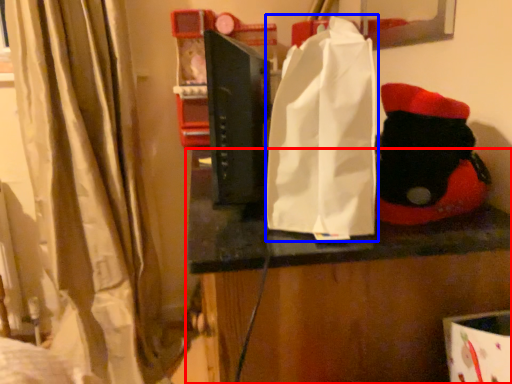
Question: Among these objects, which one is farthest to the camera, furniture (highlighted by a red box) or grocery bag (highlighted by a blue box)?

Choices:
 (A) furniture
 (B) grocery bag

Answer: (A)